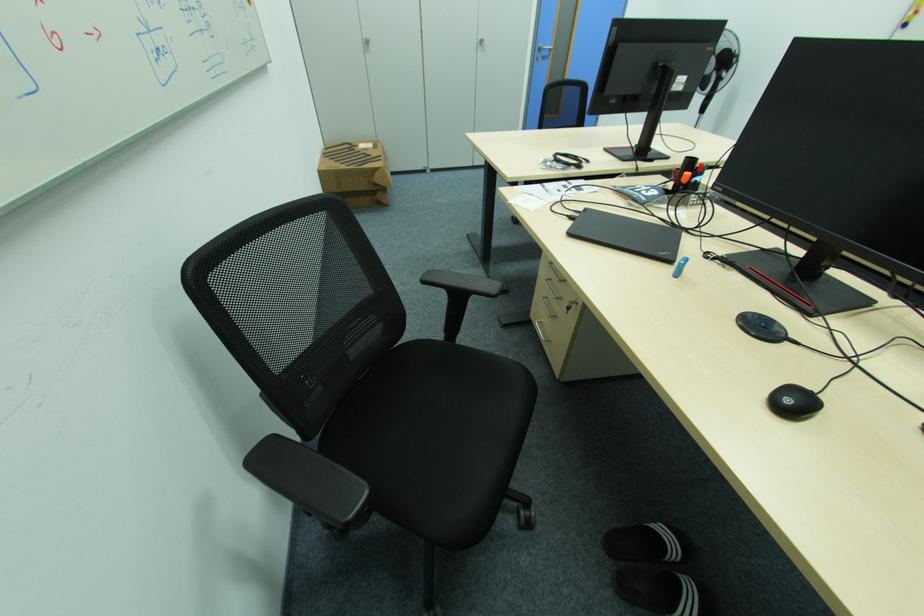
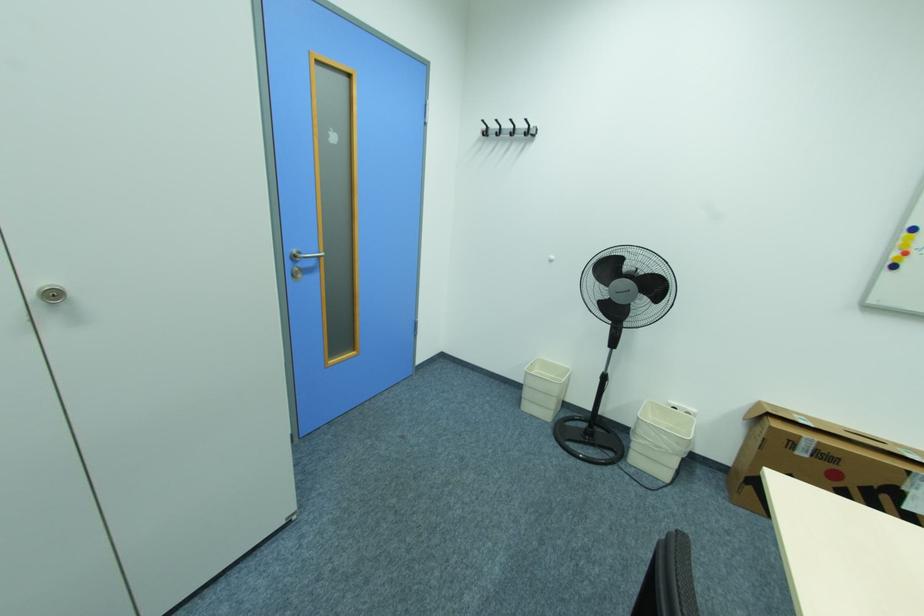
Where in the second image is the point corresponding to [487,43] from the first image?

(64, 294)